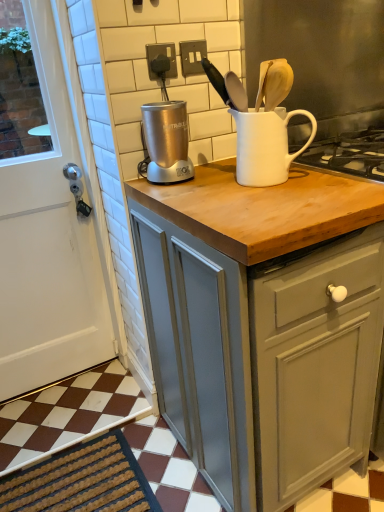
I want to click on vacant space that is in between satin silver blender at upper center and white ceramic jug at upper center, so click(207, 175).